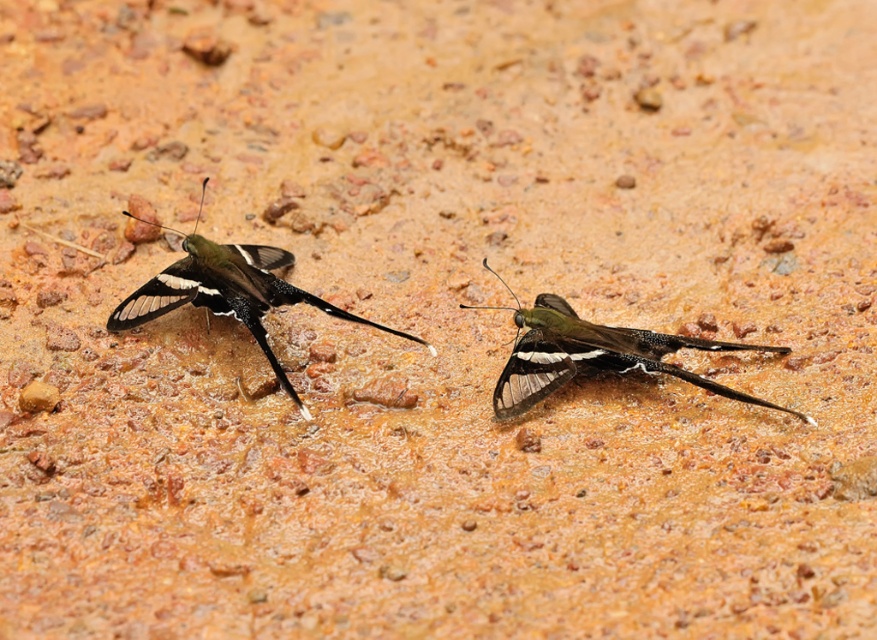
Question: Does shiny green butterfly at center come in front of matte black butterfly at left?

Choices:
 (A) no
 (B) yes

Answer: (B)

Question: Among these objects, which one is farthest from the camera?

Choices:
 (A) matte black butterfly at left
 (B) shiny green butterfly at center

Answer: (A)

Question: Does shiny green butterfly at center have a greater width compared to matte black butterfly at left?

Choices:
 (A) yes
 (B) no

Answer: (B)

Question: Can you confirm if shiny green butterfly at center is bigger than matte black butterfly at left?

Choices:
 (A) yes
 (B) no

Answer: (B)